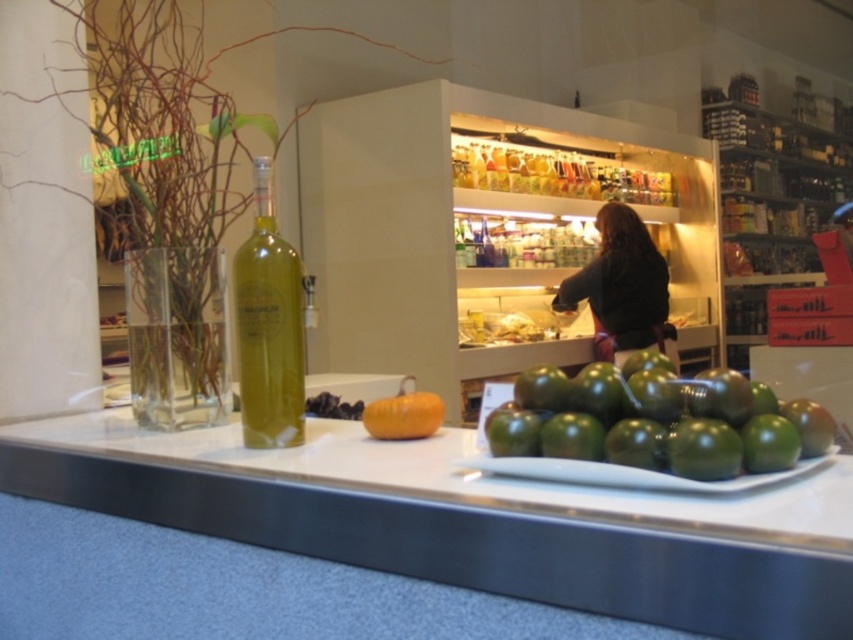
Which is behind, point (642, 323) or point (422, 396)?

The point (642, 323) is more distant.

Identify the location of black fabric at center. (622, 288).

Is white glossy counter at center to the left of orange matte pumpkin at center from the viewer's perspective?

Yes, white glossy counter at center is to the left of orange matte pumpkin at center.

Is point (605, 561) positioned after point (410, 392)?

No, (605, 561) is closer to viewer.

This screenshot has height=640, width=853. Find the location of `white glossy counter at center`. white glossy counter at center is located at coordinates (468, 518).

Who is higher up, green glass bottle at center or black fabric at center?

black fabric at center

Does point (276, 260) come in front of point (653, 300)?

Yes, it is in front of point (653, 300).

Locate an element on the screen. Image resolution: width=853 pixels, height=640 pixels. green glass bottle at center is located at coordinates (268, 326).